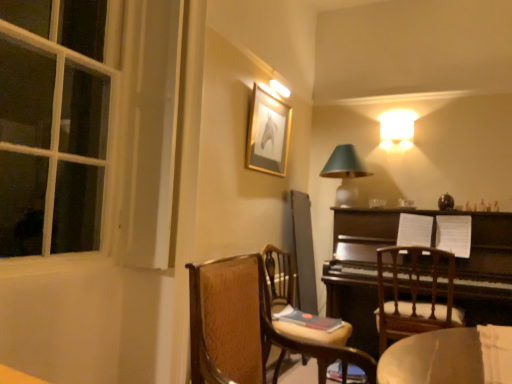
This screenshot has height=384, width=512. I want to click on gold-framed picture at upper center, so click(x=267, y=133).

Locate an element on the screen. This screenshot has width=512, height=384. matte green glass table lamp at upper right is located at coordinates (345, 173).

Consider the image. Is dark brown polished wood piano at right located within gold-framed picture at upper center?

Definitely not — dark brown polished wood piano at right is not inside gold-framed picture at upper center.

Is gold-framed picture at upper center facing away from dark brown polished wood piano at right?

gold-framed picture at upper center does not have its back to dark brown polished wood piano at right.

I want to click on picture frame on the left of dark brown polished wood piano at right, so click(x=267, y=133).

From the image's perspective, which one is positioned higher, gold-framed picture at upper center or dark brown polished wood piano at right?

gold-framed picture at upper center appears higher in the image.

Is point (305, 348) in front of point (279, 144)?

Yes.

In the scene shown: From a real-world perspective, who is located lower, wooden chair at center, placed as the 3th chair when sorted from back to front, or gold-framed picture at upper center?

wooden chair at center, placed as the 3th chair when sorted from back to front, is physically lower.

What's the angular difference between wooden chair at center, placed as the 1th chair when sorted from front to back, and gold-framed picture at upper center's facing directions?

They differ by 2.94 degrees in their facing directions.

Is wooden chair at center, placed as the 3th chair when sorted from back to front, directly adjacent to gold-framed picture at upper center?

No, wooden chair at center, placed as the 3th chair when sorted from back to front, is not beside gold-framed picture at upper center.

Can you confirm if wooden chair at center, placed as the 1th chair when sorted from front to back, is positioned to the left of wooden chair at right, marked as the 1th chair in a back-to-front arrangement?

Indeed, wooden chair at center, placed as the 1th chair when sorted from front to back, is positioned on the left side of wooden chair at right, marked as the 1th chair in a back-to-front arrangement.

Which of these two, wooden chair at center, placed as the 3th chair when sorted from back to front, or wooden chair at right, the 3th chair positioned from the front, stands shorter?

Standing shorter between the two is wooden chair at center, placed as the 3th chair when sorted from back to front.

Does point (241, 261) come closer to viewer compared to point (417, 280)?

Yes, it is in front of point (417, 280).

Is wooden chair at center, placed as the 1th chair when sorted from front to back, to the right of matte green glass table lamp at upper right from the viewer's perspective?

In fact, wooden chair at center, placed as the 1th chair when sorted from front to back, is to the left of matte green glass table lamp at upper right.

Does wooden chair at center, placed as the 3th chair when sorted from back to front, have a greater height compared to matte green glass table lamp at upper right?

No.

Which is in front, point (229, 263) or point (340, 162)?

The point (229, 263) is more forward.

From a real-world perspective, does wooden chair at center, placed as the 1th chair when sorted from front to back, stand above matte green glass table lamp at upper right?

No, from a real-world perspective, wooden chair at center, placed as the 1th chair when sorted from front to back, is not on top of matte green glass table lamp at upper right.

Is matte green glass table lamp at upper right outside of gold-framed picture at upper center?

Indeed, matte green glass table lamp at upper right is completely outside gold-framed picture at upper center.

Is gold-framed picture at upper center at the back of matte green glass table lamp at upper right?

matte green glass table lamp at upper right does not have its back to gold-framed picture at upper center.

Looking at this image, who is taller, matte green glass table lamp at upper right or gold-framed picture at upper center?

Standing taller between the two is gold-framed picture at upper center.

This screenshot has width=512, height=384. Find the location of `table lamp that is on the right side of gold-framed picture at upper center`. table lamp that is on the right side of gold-framed picture at upper center is located at coordinates (345, 173).

From a real-world perspective, which object rests below the other?

matte green glass table lamp at upper right, from a real-world perspective.

There is a matte green glass table lamp at upper right. At what (x,y) coordinates should I click in order to perform the action: click on picture frame above it (from a real-world perspective). Please return your answer as a coordinate pair (x, y). This screenshot has width=512, height=384. Looking at the image, I should click on (267, 133).

Which is behind, gold-framed picture at upper center or matte green glass table lamp at upper right?

matte green glass table lamp at upper right is further from the camera.

From the image's perspective, which one is positioned lower, gold-framed picture at upper center or matte green glass table lamp at upper right?

From the image's view, matte green glass table lamp at upper right is below.

Is wooden chair at right, marked as the 1th chair in a back-to-front arrangement, positioned with its back to dark brown polished wood piano at right?

Absolutely, wooden chair at right, marked as the 1th chair in a back-to-front arrangement, is directed away from dark brown polished wood piano at right.

In the scene shown: Is wooden chair at right, marked as the 1th chair in a back-to-front arrangement, not inside dark brown polished wood piano at right?

No.

From a real-world perspective, which object rests below the other?

wooden chair at right, marked as the 1th chair in a back-to-front arrangement, is physically lower.

Looking at the image, does wooden chair at right, the 3th chair positioned from the front, seem bigger or smaller compared to dark brown polished wood piano at right?

In the image, wooden chair at right, the 3th chair positioned from the front, appears to be smaller than dark brown polished wood piano at right.

I want to click on piano that appears below the gold-framed picture at upper center (from the image's perspective), so click(394, 244).

You are a GUI agent. You are given a task and a screenshot of the screen. Output one action in this format:
    pyautogui.click(x=<x>, y=<y>)
    Task: Click on the picture frame to the left of wooden chair at center, placed as the 1th chair when sorted from front to back
    This screenshot has height=384, width=512.
    Given the screenshot: What is the action you would take?
    pyautogui.click(x=267, y=133)

When comparing their distances from wooden chair at center, placed as the 3th chair when sorted from back to front, does gold-framed picture at upper center or wooden chair at center, the 2th chair viewed from the front, seem further?

Based on the image, gold-framed picture at upper center appears to be further to wooden chair at center, placed as the 3th chair when sorted from back to front.

Which object lies nearer to the anchor point wooden chair at center, placed as the 1th chair when sorted from front to back, gold-framed picture at upper center or wooden chair at right, marked as the 1th chair in a back-to-front arrangement?

wooden chair at right, marked as the 1th chair in a back-to-front arrangement, is closer to wooden chair at center, placed as the 1th chair when sorted from front to back.

Based on their spatial positions, is dark brown polished wood piano at right or wooden chair at center, placed as the 1th chair when sorted from front to back, closer to wooden chair at right, the 3th chair positioned from the front?

dark brown polished wood piano at right lies closer to wooden chair at right, the 3th chair positioned from the front, than the other object.

Considering their positions, is matte green glass table lamp at upper right positioned closer to gold-framed picture at upper center than wooden chair at center, placed as the 1th chair when sorted from front to back?

Based on the image, matte green glass table lamp at upper right appears to be nearer to gold-framed picture at upper center.

From the image, which object appears to be farther from matte green glass table lamp at upper right, wooden chair at center, the 2th chair viewed from the front, or wooden chair at center, placed as the 3th chair when sorted from back to front?

wooden chair at center, placed as the 3th chair when sorted from back to front, is positioned further to the anchor matte green glass table lamp at upper right.

Consider the image. Based on their spatial positions, is dark brown polished wood piano at right or wooden chair at center, placed as the 1th chair when sorted from front to back, further from wooden chair at center, the 2th chair when ordered from back to front?

The object further to wooden chair at center, the 2th chair when ordered from back to front, is dark brown polished wood piano at right.

Considering their positions, is matte green glass table lamp at upper right positioned closer to wooden chair at center, placed as the 3th chair when sorted from back to front, than gold-framed picture at upper center?

The object closer to wooden chair at center, placed as the 3th chair when sorted from back to front, is gold-framed picture at upper center.

Estimate the real-world distances between objects in this image. Which object is further from matte green glass table lamp at upper right, gold-framed picture at upper center or wooden chair at right, marked as the 1th chair in a back-to-front arrangement?

wooden chair at right, marked as the 1th chair in a back-to-front arrangement, is positioned further to the anchor matte green glass table lamp at upper right.

Locate an element on the screen. The height and width of the screenshot is (384, 512). piano between matte green glass table lamp at upper right and wooden chair at center, the 2th chair when ordered from back to front, vertically is located at coordinates (394, 244).

Where is `piano located between wooden chair at center, placed as the 3th chair when sorted from back to front, and gold-framed picture at upper center in the depth direction`? This screenshot has width=512, height=384. piano located between wooden chair at center, placed as the 3th chair when sorted from back to front, and gold-framed picture at upper center in the depth direction is located at coordinates (394, 244).

Locate an element on the screen. table lamp between gold-framed picture at upper center and wooden chair at right, the 3th chair positioned from the front, in the up-down direction is located at coordinates (345, 173).

This screenshot has width=512, height=384. Identify the location of piano between wooden chair at center, placed as the 3th chair when sorted from back to front, and matte green glass table lamp at upper right, along the z-axis. (394, 244).